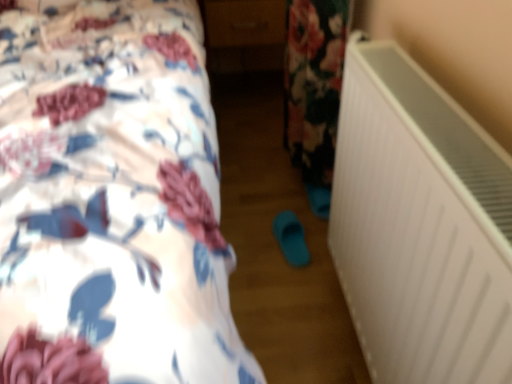
Question: Are white matte radiator at right and teal rubber slipper at center beside each other?

Choices:
 (A) no
 (B) yes

Answer: (A)

Question: Is white matte radiator at right at the right side of teal rubber slipper at center?

Choices:
 (A) no
 (B) yes

Answer: (B)

Question: From a real-world perspective, is white matte radiator at right positioned over teal rubber slipper at center based on gravity?

Choices:
 (A) yes
 (B) no

Answer: (A)

Question: Can you confirm if white matte radiator at right is taller than teal rubber slipper at center?

Choices:
 (A) no
 (B) yes

Answer: (B)

Question: From the image's perspective, would you say white matte radiator at right is shown under teal rubber slipper at center?

Choices:
 (A) yes
 (B) no

Answer: (B)

Question: Considering the relative sizes of white matte radiator at right and teal rubber slipper at center in the image provided, is white matte radiator at right wider than teal rubber slipper at center?

Choices:
 (A) no
 (B) yes

Answer: (B)

Question: Is floral fabric bed at upper left bigger than white matte radiator at right?

Choices:
 (A) yes
 (B) no

Answer: (A)

Question: Considering the relative sizes of floral fabric bed at upper left and white matte radiator at right in the image provided, is floral fabric bed at upper left thinner than white matte radiator at right?

Choices:
 (A) yes
 (B) no

Answer: (B)

Question: Is white matte radiator at right located within floral fabric bed at upper left?

Choices:
 (A) no
 (B) yes

Answer: (A)

Question: From the image's perspective, is floral fabric bed at upper left over white matte radiator at right?

Choices:
 (A) no
 (B) yes

Answer: (B)

Question: Considering the relative positions of floral fabric bed at upper left and white matte radiator at right in the image provided, is floral fabric bed at upper left in front of white matte radiator at right?

Choices:
 (A) yes
 (B) no

Answer: (A)

Question: Is floral fabric bed at upper left positioned with its back to white matte radiator at right?

Choices:
 (A) yes
 (B) no

Answer: (B)

Question: Can you confirm if floral fabric bed at upper left is positioned to the right of matte brown drawer at center?

Choices:
 (A) no
 (B) yes

Answer: (A)